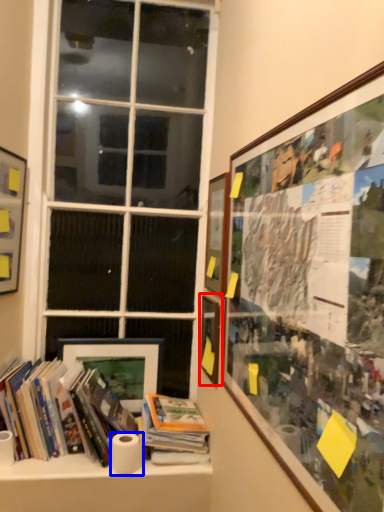
Question: Which object appears closest to the camera in this image, picture frame (highlighted by a red box) or toilet paper (highlighted by a blue box)?

Choices:
 (A) picture frame
 (B) toilet paper

Answer: (B)